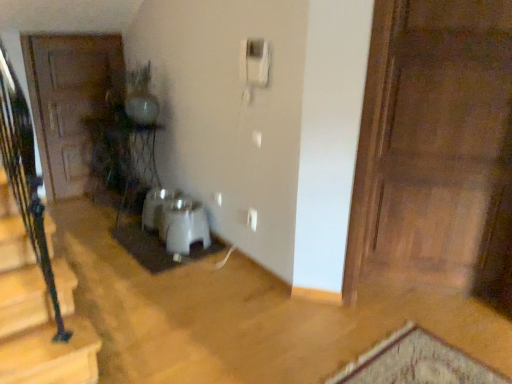
I want to click on empty space that is ontop of white plastic water heater at center (from a real-world perspective), so click(x=179, y=210).